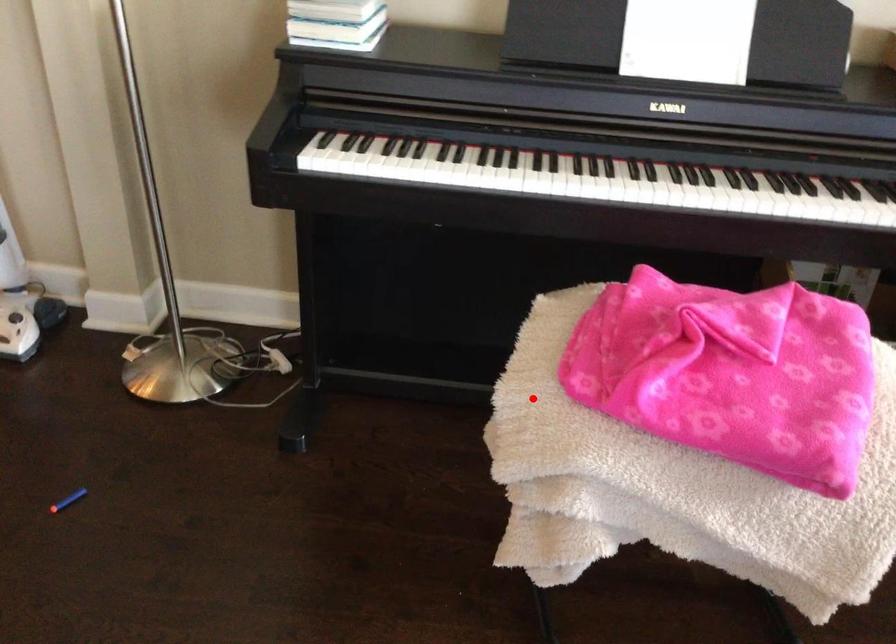
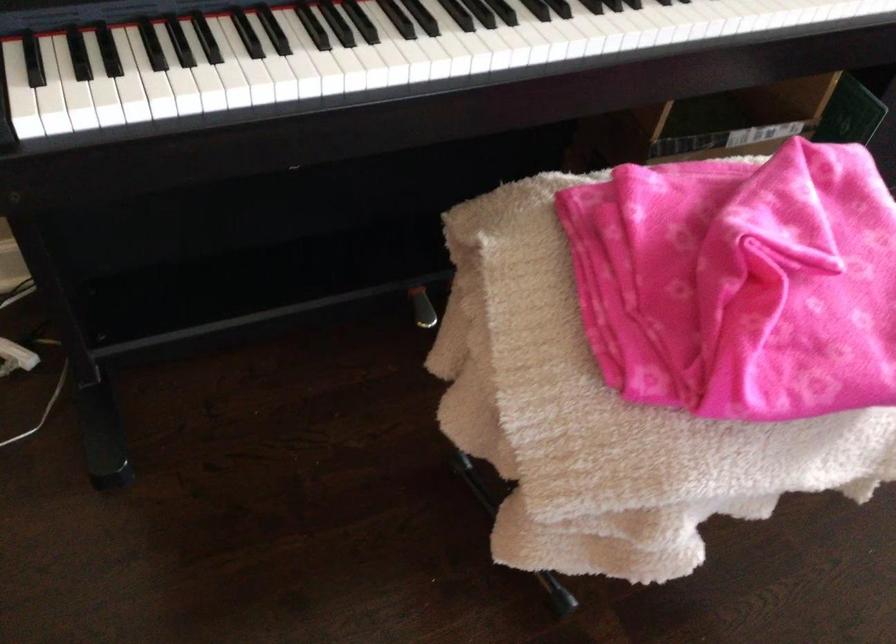
Question: A red point is marked in image1. In image2, is the corresponding 3D point closer to the camera or farther? Reply with the corresponding letter.

Choices:
 (A) The corresponding 3D point is closer.
 (B) The corresponding 3D point is farther.

Answer: (A)